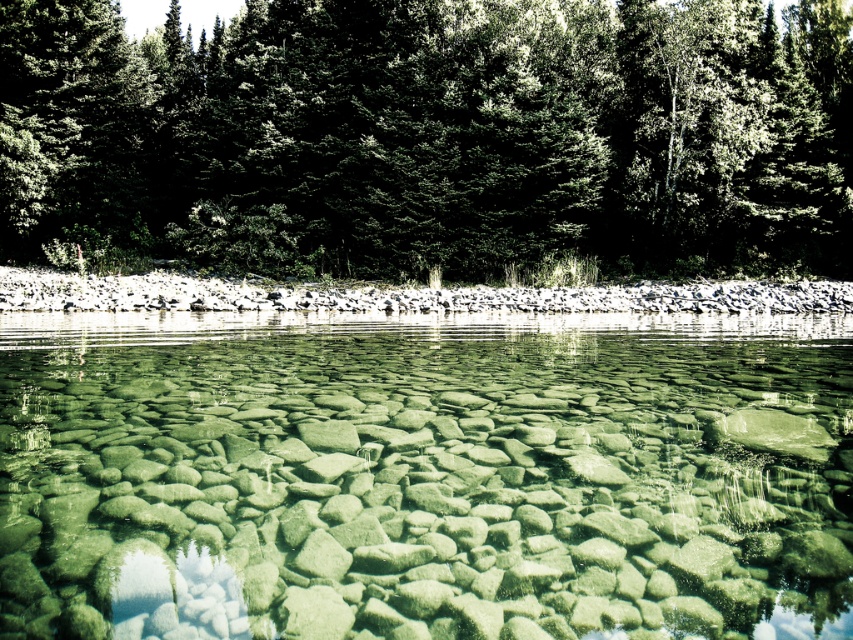
You are standing at the edge of the green stone river at center and want to reach the green textured trees at upper center. Which direction should you move to get closer to the trees?

To reach the green textured trees at upper center from the green stone river at center, you should move forward since the trees are located in the background and are taller than the river.

You are standing at the edge of the green stone river at center and want to look up at the green textured trees at upper center. In which direction should you look?

The green stone river at center is located below green textured trees at upper center, so you should look upward to see the green textured trees at upper center.

You are standing at the edge of the green stone river at center and want to walk to the green textured trees at upper center. Which direction should you head towards to reach them?

The green textured trees at upper center are located in the upper part of the scene, so you should head upwards from the green stone river at center to reach them.